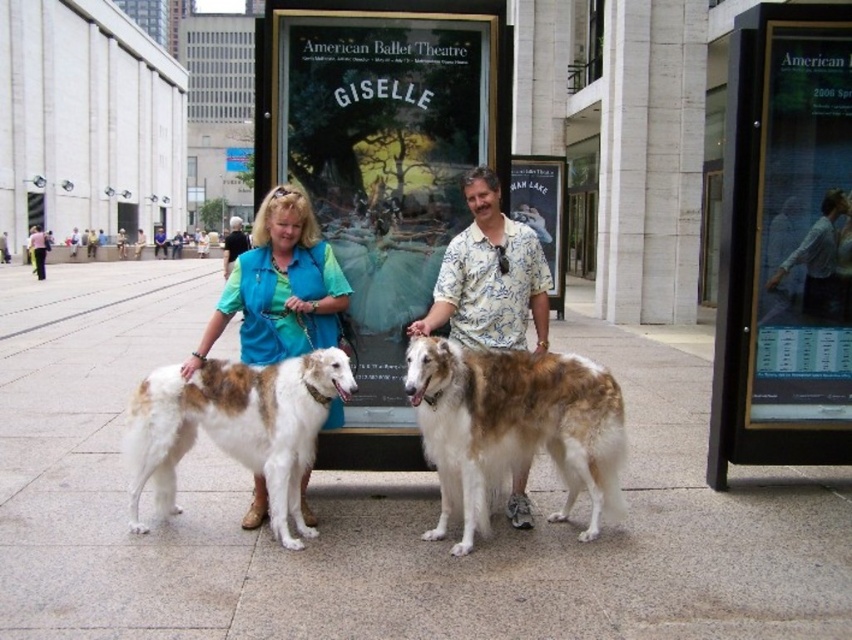
You are a photographer wanting to capture a photo of the white marble pavement at center and the brown and white fur at center. Which object is higher in the image?

The white marble pavement at center has a greater height compared to the brown and white fur at center, so the white marble pavement at center is higher in the image.

You are a photographer trying to capture a group photo of the two people and their dogs. You notice the white fur at center and the blue fabric shirt at center. Which object should you focus on first if you want to ensure both are in focus?

The white fur at center is located below the blue fabric shirt at center, so focusing on the blue fabric shirt at center first will ensure both objects are in focus since it is higher up and closer to the camera.